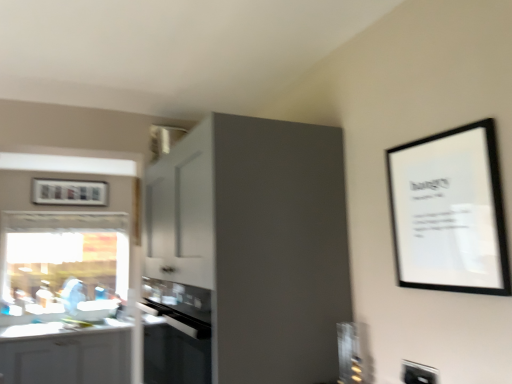
Question: Is point (278, 311) positioned closer to the camera than point (434, 380)?

Choices:
 (A) closer
 (B) farther

Answer: (B)

Question: From their relative heights in the image, would you say matte gray cabinet at upper center, which is the 1th cabinetry from right to left, is taller or shorter than white plastic electric outlet at lower right?

Choices:
 (A) tall
 (B) short

Answer: (A)

Question: Which object is positioned closest to the black glass oven at center?

Choices:
 (A) black matte picture frame at upper right, placed as the 1th picture frame when sorted from right to left
 (B) matte plastic picture frame at upper left, the 1th picture frame positioned from the back
 (C) white plastic electric outlet at lower right
 (D) white glossy cabinet at lower left, which is the 2th cabinetry from top to bottom
 (E) white glossy countertop at lower left

Answer: (C)

Question: Estimate the real-world distances between objects in this image. Which object is closer to the matte plastic picture frame at upper left, the 1th picture frame positioned from the back?

Choices:
 (A) white plastic electric outlet at lower right
 (B) white glossy cabinet at lower left, the 1th cabinetry positioned from the left
 (C) white glossy countertop at lower left
 (D) black glass oven at center
 (E) transparent glass window at left

Answer: (E)